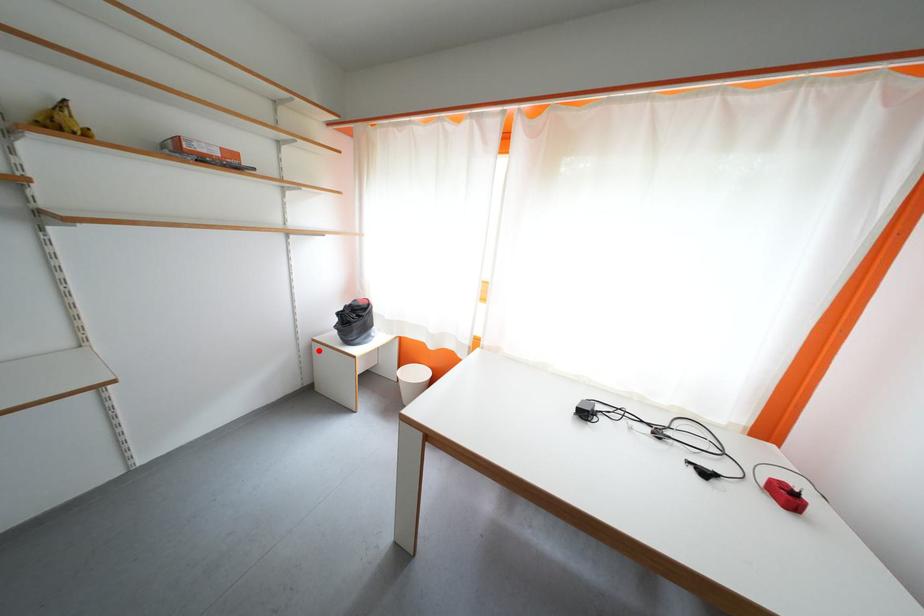
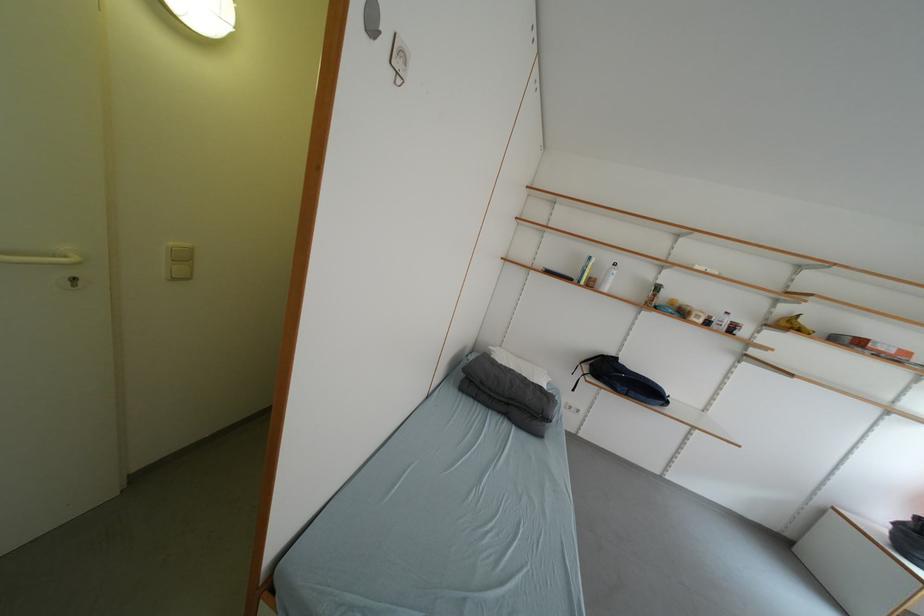
In the second image, find the point that corresponds to the highlighted location in the first image.

(832, 515)